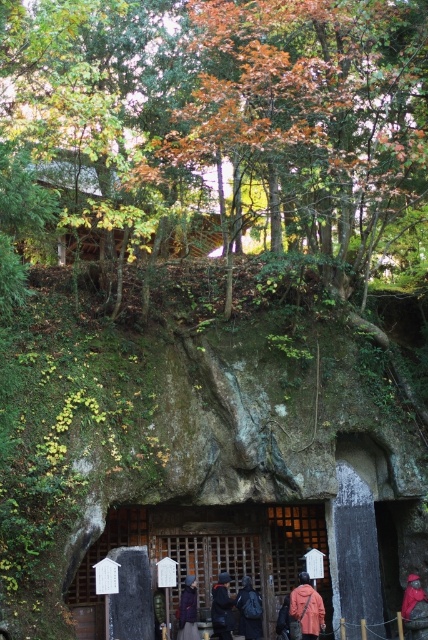
Question: Is the position of wooden cabin at upper center more distant than that of red fabric jacket at center?

Choices:
 (A) no
 (B) yes

Answer: (A)

Question: Can you confirm if pink fabric coat at center is smaller than red fabric jacket at center?

Choices:
 (A) yes
 (B) no

Answer: (B)

Question: Which point appears closest to the camera in this image?

Choices:
 (A) (216, 612)
 (B) (241, 605)
 (C) (181, 618)

Answer: (C)

Question: Can you confirm if red fabric jacket at center is bigger than dark blue backpack at center?

Choices:
 (A) yes
 (B) no

Answer: (A)

Question: Which of the following is the closest to the observer?

Choices:
 (A) dark blue jacket at center
 (B) wooden cabin at upper center

Answer: (B)

Question: Which object is closer to the camera taking this photo?

Choices:
 (A) dark blue jacket at center
 (B) dark blue backpack at center
 (C) wooden cabin at upper center

Answer: (C)